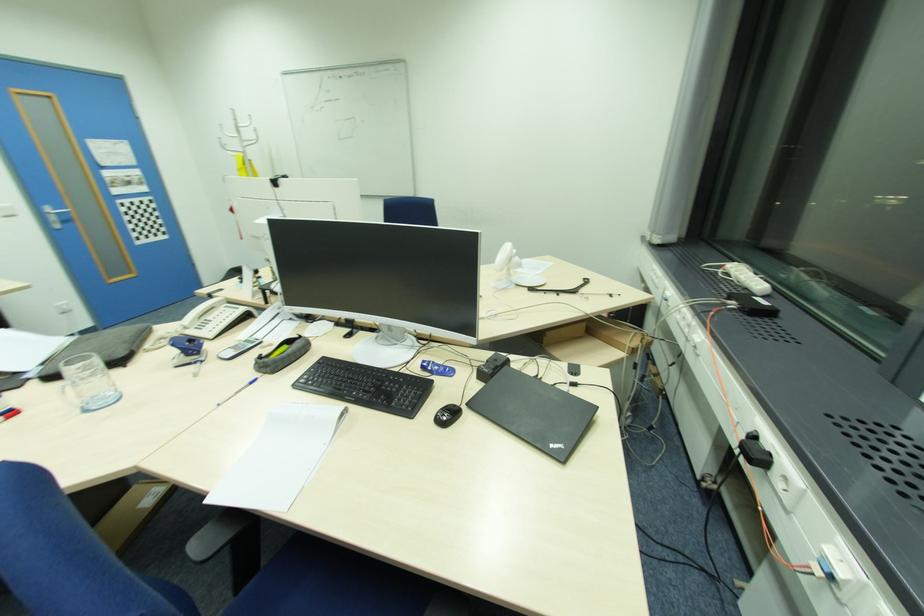
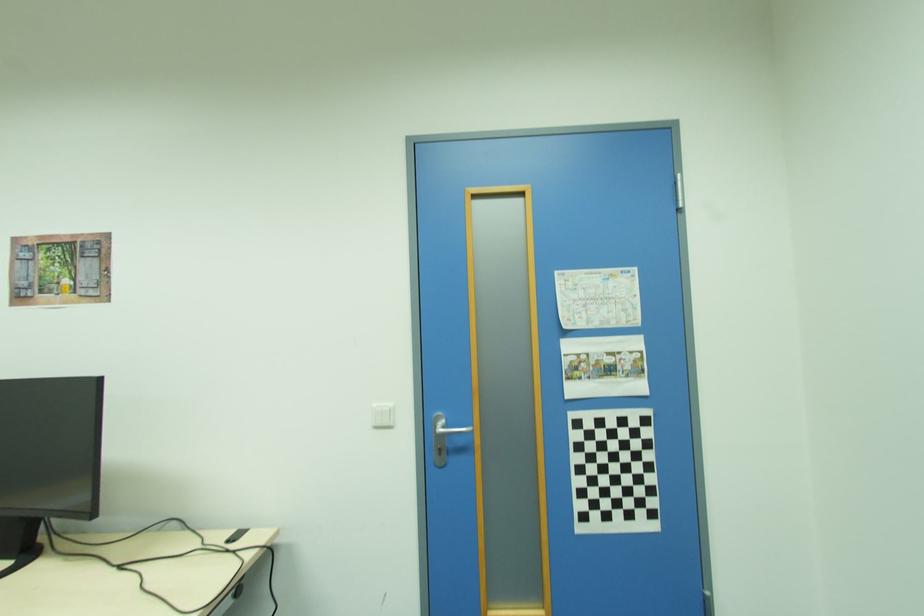
Where in the second image is the point corresponding to point 167,233 from the first image?

(655, 515)